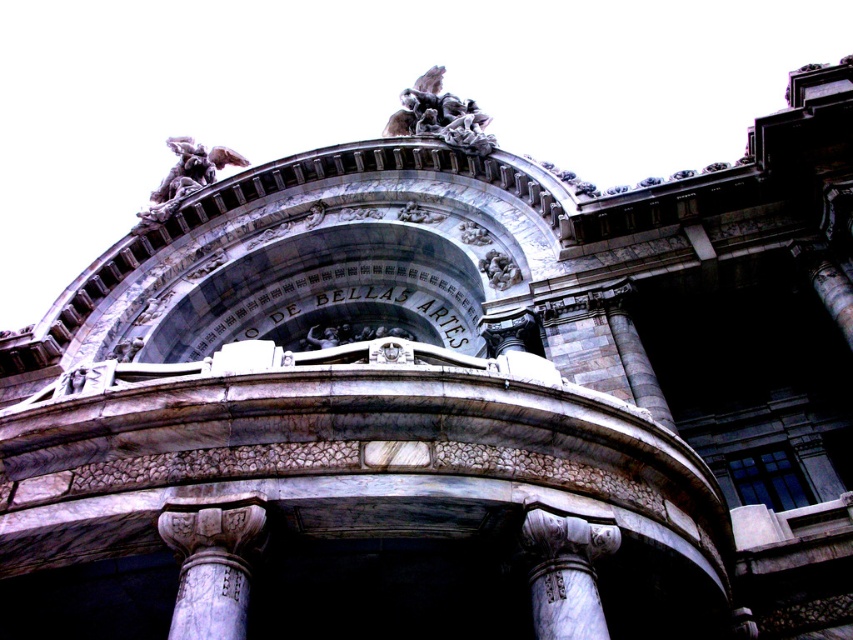
You are an architect examining the building facade. You need to determine if the white marble column at lower center can fit through a doorway that is the same width as the polished stone sculpture at center. Based on their widths, will the column fit?

The white marble column at lower center might be wider than the polished stone sculpture at center, so there is a possibility it cannot fit through the doorway unless adjusted.

You are a tour guide leading a group to the entrance of the TEATRO DE BELLAS ARTES. You want to point out both the white marble column at lower center and the polished stone angel at upper center. How far apart are these two elements from each other?

The white marble column at lower center and the polished stone angel at upper center are 76.83 meters apart from each other.